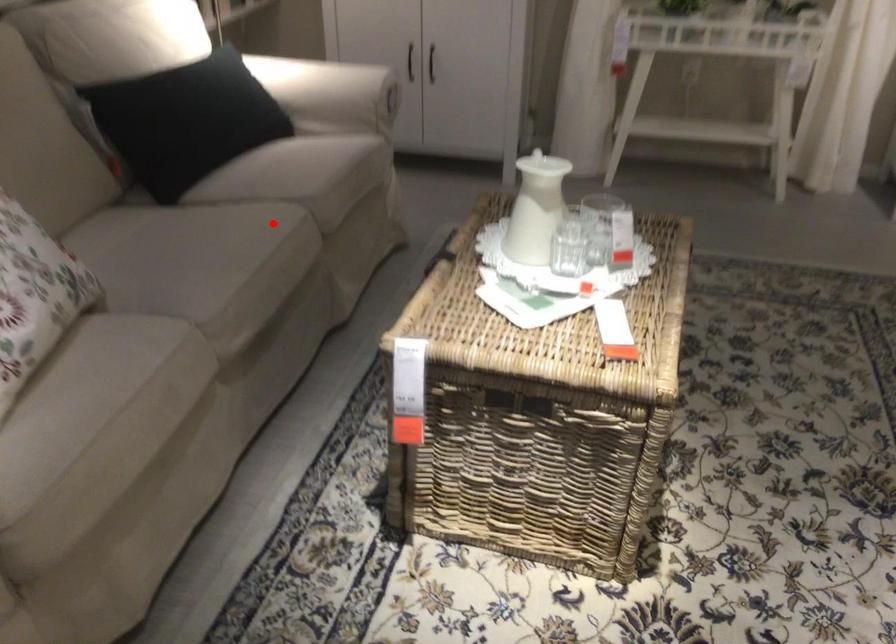
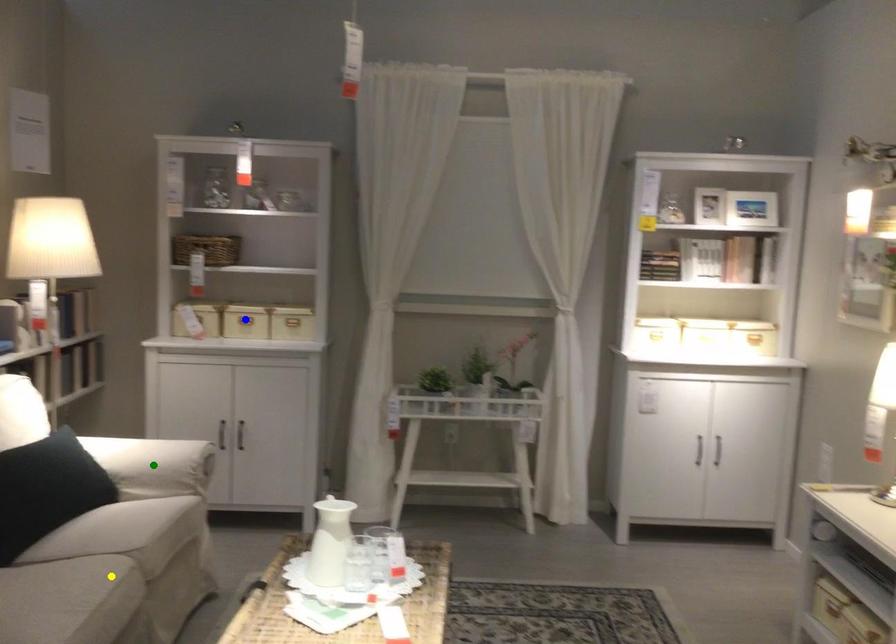
Question: I am providing you with two images of the same scene from different viewpoints. A red point is marked on the first image. You are given multiple points on the second image. Which mark in image 2 goes with the point in image 1?

Choices:
 (A) blue point
 (B) yellow point
 (C) green point

Answer: (B)